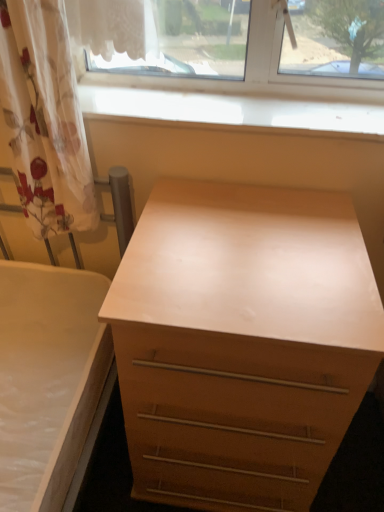
You are a GUI agent. You are given a task and a screenshot of the screen. Output one action in this format:
    pyautogui.click(x=<x>, y=<y>)
    Task: Click on the free space above light wood chest of drawers at center (from a real-world perspective)
    This screenshot has height=512, width=384.
    Given the screenshot: What is the action you would take?
    pyautogui.click(x=241, y=245)